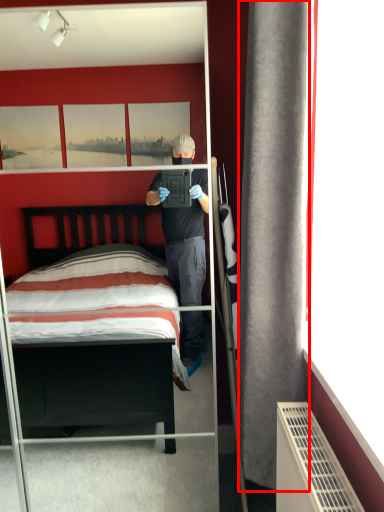
Question: From the image, what is the correct spatial relationship of curtain (annotated by the red box) in relation to mirror?

Choices:
 (A) right
 (B) left

Answer: (A)